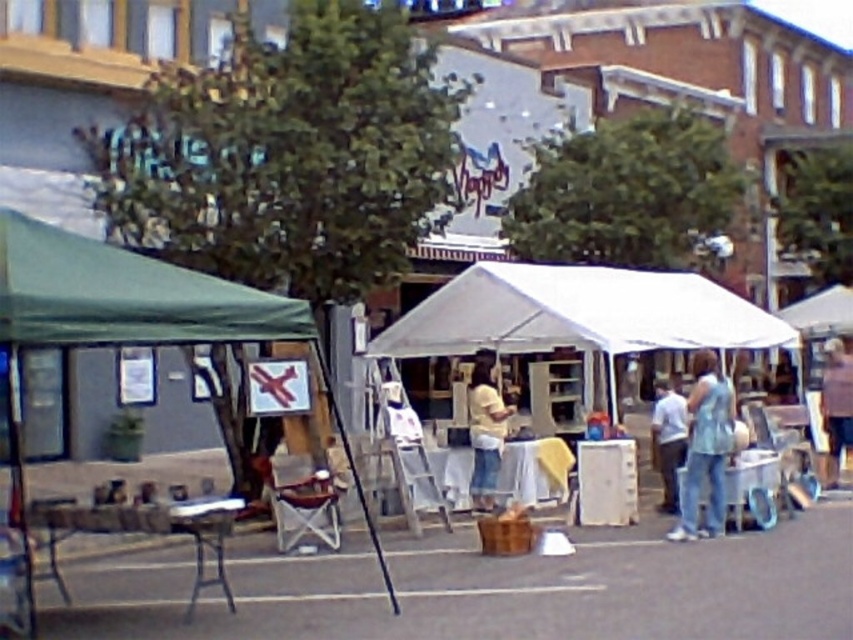
Who is more forward, (543, 323) or (479, 486)?

Point (479, 486) is in front.

Who is lower down, white fabric tent at center or yellow cotton shirt at center?

yellow cotton shirt at center

This screenshot has width=853, height=640. Find the location of `white fabric tent at center`. white fabric tent at center is located at coordinates (578, 314).

Is point (834, 429) closer to camera compared to point (672, 509)?

That is False.

Who is more distant from viewer, (834, 385) or (657, 461)?

Positioned behind is point (657, 461).

Where is `brown fabric jacket at upper right`? This screenshot has height=640, width=853. brown fabric jacket at upper right is located at coordinates (836, 404).

Based on the photo, between green fabric canopy at left and light blue denim jeans at lower right, which one is positioned higher?

green fabric canopy at left is above.

This screenshot has width=853, height=640. What are the coordinates of `green fabric canopy at left` in the screenshot? It's located at (125, 296).

The width and height of the screenshot is (853, 640). Identify the location of green fabric canopy at left. (125, 296).